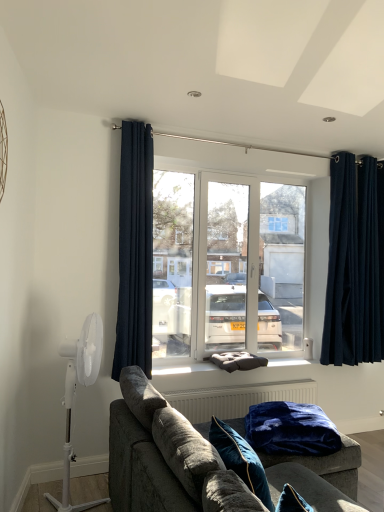
Question: In terms of width, does white plastic mechanical fan at left look wider or thinner when compared to velvet gray couch at center?

Choices:
 (A) thin
 (B) wide

Answer: (A)

Question: Is white plastic mechanical fan at left taller or shorter than velvet gray couch at center?

Choices:
 (A) short
 (B) tall

Answer: (B)

Question: Estimate the real-world distances between objects in this image. Which object is closer to the dark blue textured curtain at center, acting as the 2th curtain starting from the right?

Choices:
 (A) velvet gray couch at center
 (B) dark fabric cushion at center
 (C) dark gray plush pillow at center, acting as the 1th pillow starting from the back
 (D) velvet blue pillow at lower center, arranged as the first pillow when viewed from the front
 (E) navy blue velvet curtains at right, the 2th curtain from the front

Answer: (B)

Question: Which is farther from the velvet blue pillow at lower center, arranged as the first pillow when viewed from the front?

Choices:
 (A) navy blue velvet curtains at right, arranged as the second curtain when viewed from the left
 (B) white glossy door at center
 (C) dark fabric cushion at center
 (D) white plastic mechanical fan at left
 (E) dark gray plush pillow at center, arranged as the second pillow when viewed from the front

Answer: (A)